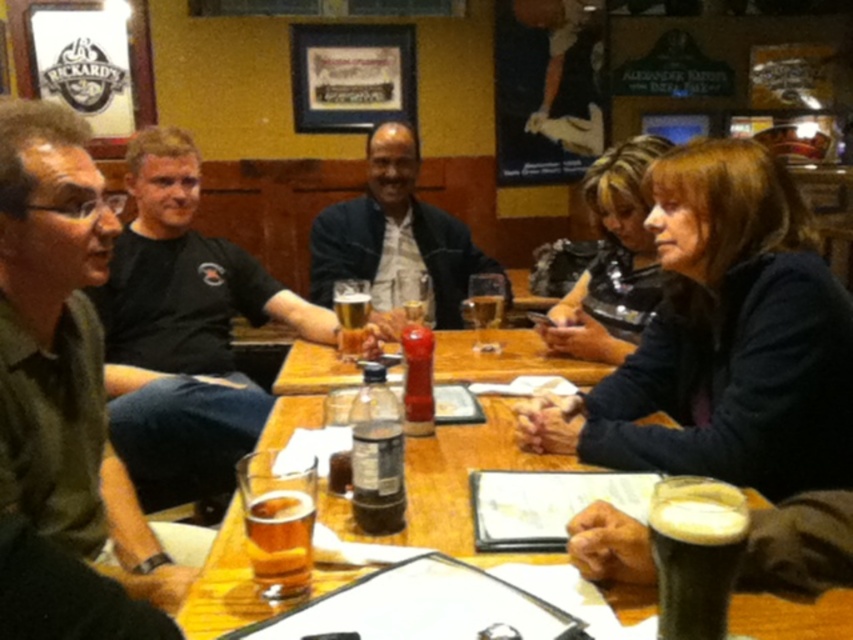
Where is `dark brown hair at center`? The image size is (853, 640). dark brown hair at center is located at coordinates (724, 339).

Is dark brown hair at center positioned at the back of translucent plastic bottle at center?

Yes, dark brown hair at center is further from the viewer.

What do you see at coordinates (724, 339) in the screenshot? This screenshot has height=640, width=853. I see `dark brown hair at center` at bounding box center [724, 339].

Locate an element on the screen. dark brown hair at center is located at coordinates 724,339.

Which of these two, dark brown hair at center or amber glass beer at center, stands taller?

dark brown hair at center

Who is shorter, dark brown hair at center or amber glass beer at center?

Standing shorter between the two is amber glass beer at center.

Is point (831, 481) farther from viewer compared to point (300, 518)?

Yes, it is.

Find the location of a particular element. dark brown hair at center is located at coordinates (724, 339).

Can you confirm if denim jacket at center is positioned below translucent plastic bottle at center?

No, denim jacket at center is not below translucent plastic bottle at center.

Does denim jacket at center have a larger size compared to translucent plastic bottle at center?

Yes.

You are a GUI agent. You are given a task and a screenshot of the screen. Output one action in this format:
    pyautogui.click(x=<x>, y=<y>)
    Task: Click on the denim jacket at center
    
    Given the screenshot: What is the action you would take?
    pyautogui.click(x=395, y=234)